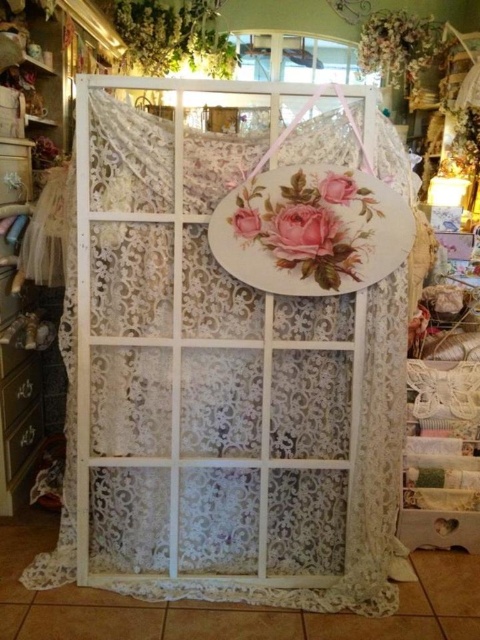
Is point (70, 566) farther from viewer compared to point (243, 220)?

That is True.

Is point (294, 355) less distant than point (253, 218)?

No, (294, 355) is behind (253, 218).

Is point (178, 579) in front of point (249, 212)?

No, it is behind (249, 212).

Identify the location of white lace curtain at center. This screenshot has width=480, height=640. (220, 378).

Can you confirm if white lace curtain at center is taller than matte pink rose at center?

Correct, white lace curtain at center is much taller as matte pink rose at center.

Does point (128, 582) come farther from viewer compared to point (332, 246)?

Yes, it is behind point (332, 246).

Locate an element on the screen. The width and height of the screenshot is (480, 640). white lace curtain at center is located at coordinates (220, 378).

Does white lace curtain at upper center appear on the left side of matte pink rose at center?

No, white lace curtain at upper center is not to the left of matte pink rose at center.

Between white lace curtain at upper center and matte pink rose at center, which one appears on the right side from the viewer's perspective?

white lace curtain at upper center is more to the right.

Who is more distant from viewer, [402,76] or [327,211]?

Point [402,76]

The width and height of the screenshot is (480, 640). Find the location of `white lace curtain at upper center`. white lace curtain at upper center is located at coordinates (399, 45).